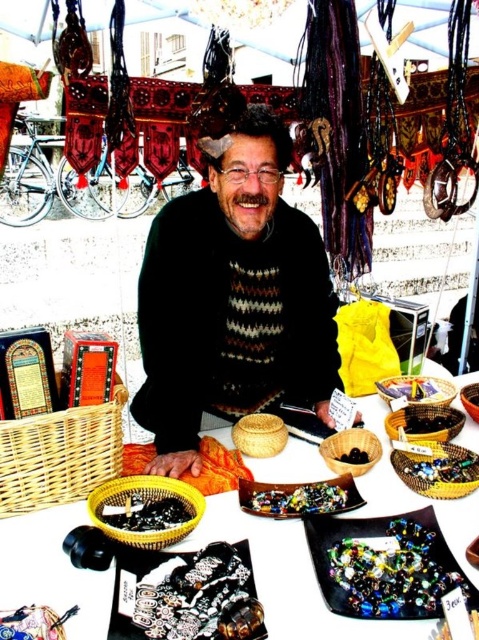
You are a customer at the market and want to buy both the translucent glass beads at center and the black glossy bowl at center. Which item is positioned to the left of the other?

The translucent glass beads at center is to the left of black glossy bowl at center.